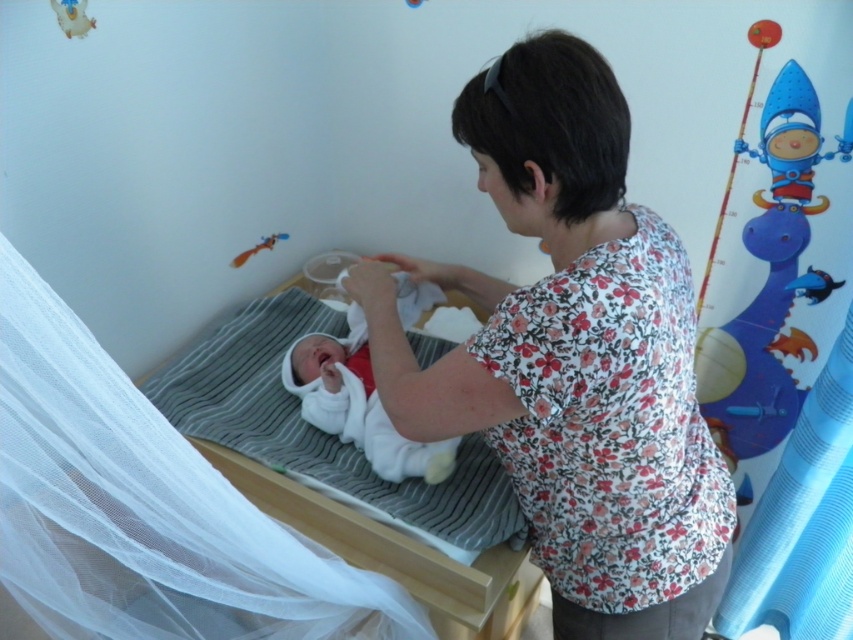
You are a photographer trying to capture the baby in the crib. The baby is currently at the point labeled point (x=387, y=547). To ensure the baby is in focus, you need to know what surface the baby is lying on. What is the surface under the baby?

The surface under the baby at point (x=387, y=547) is the white striped fabric at center, which is the mattress cover in the crib.

Looking at this image, you are standing in a nursery and see a woman wearing a floral fabric shirt at center. If you want to hand her a toy that is 3 feet away from you, will you be able to reach it without moving closer?

The floral fabric shirt at center is 32.77 inches away from viewer. Since 32.77 inches is approximately 2.73 feet, and the toy is 3 feet away, the toy is slightly farther than the distance to the woman. Therefore, you would need to move closer to reach the toy.